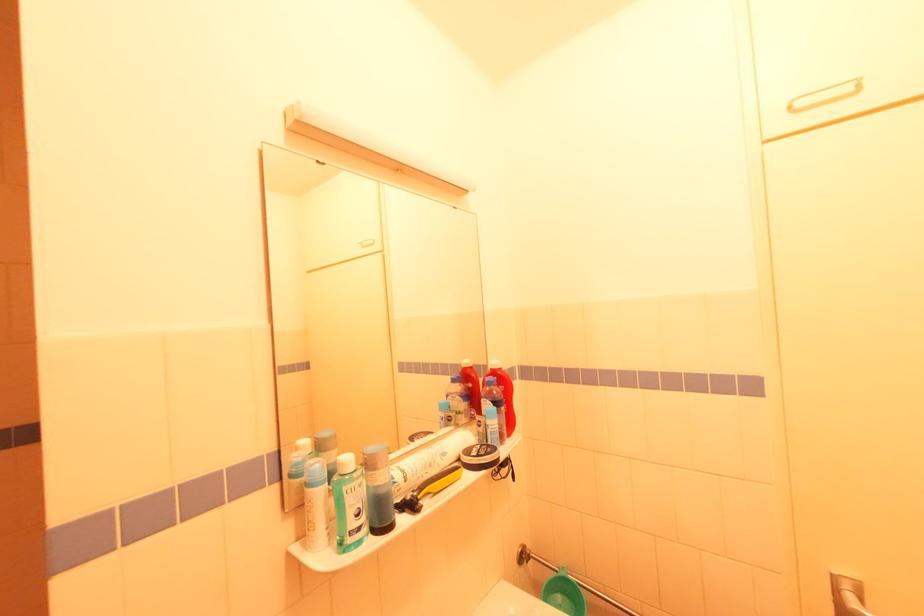
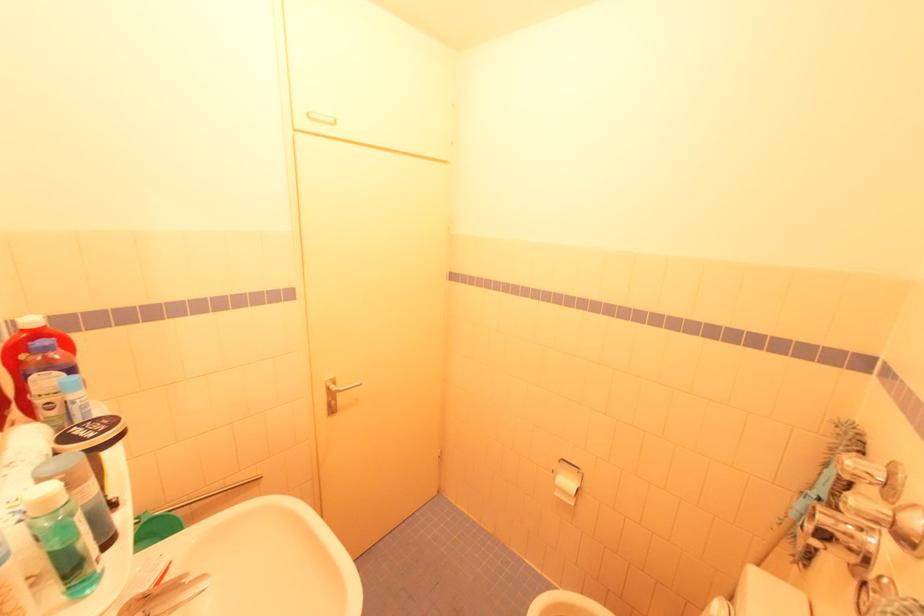
Question: Based on the continuous images, in which direction is the camera rotating? Reply with the corresponding letter.

Choices:
 (A) Left
 (B) Right
 (C) Up
 (D) Down

Answer: (B)